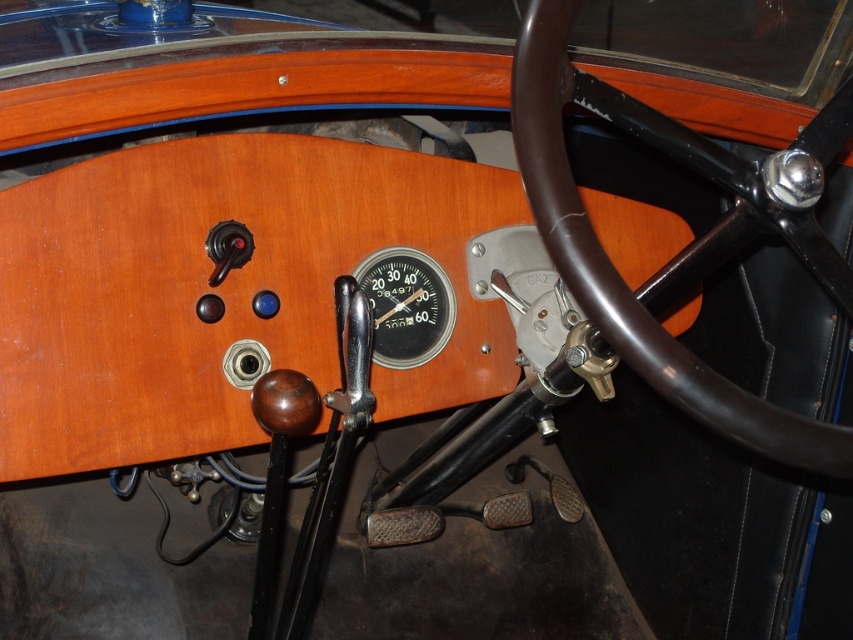
Question: Can you confirm if brown leather steering wheel at center is positioned to the left of metallic silver gauge at center?

Choices:
 (A) yes
 (B) no

Answer: (B)

Question: Which point is farther from the camera taking this photo?

Choices:
 (A) (386, 362)
 (B) (553, 104)

Answer: (A)

Question: Is brown leather steering wheel at center wider than metallic silver gauge at center?

Choices:
 (A) yes
 (B) no

Answer: (A)

Question: Among these points, which one is nearest to the camera?

Choices:
 (A) (643, 339)
 (B) (439, 301)

Answer: (A)

Question: Can you confirm if brown leather steering wheel at center is smaller than metallic silver gauge at center?

Choices:
 (A) no
 (B) yes

Answer: (A)